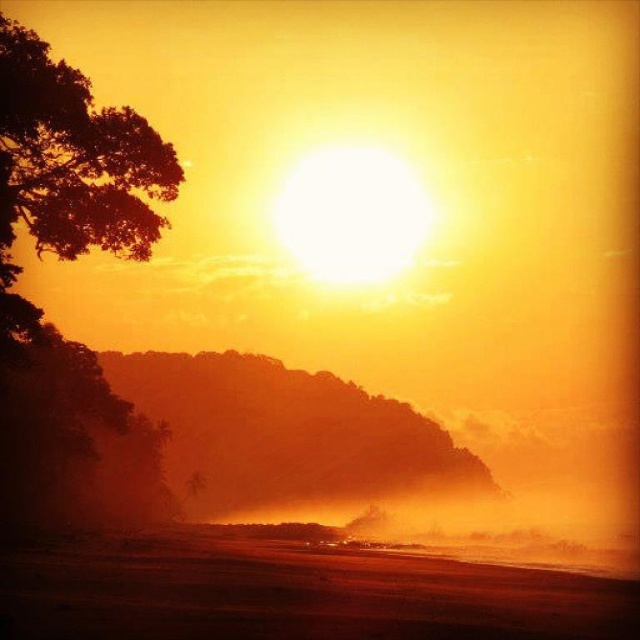
Does sandy shore at lower center have a greater width compared to silhouetted leafy tree at left?

Indeed, sandy shore at lower center has a greater width compared to silhouetted leafy tree at left.

Can you confirm if sandy shore at lower center is bigger than silhouetted leafy tree at left?

Yes, sandy shore at lower center is bigger than silhouetted leafy tree at left.

Who is more forward, (506, 627) or (36, 109)?

Positioned in front is point (506, 627).

What are the coordinates of `sandy shore at lower center` in the screenshot? It's located at (292, 593).